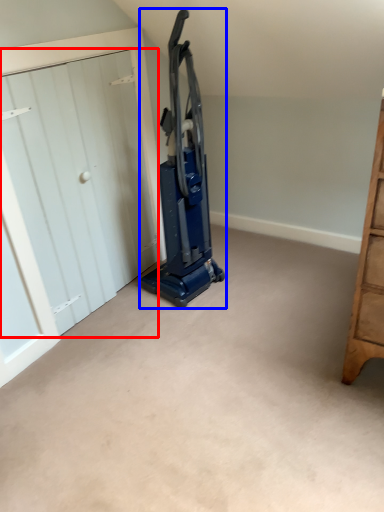
Question: Which of the following is the closest to the observer, door (highlighted by a red box) or equipment (highlighted by a blue box)?

Choices:
 (A) door
 (B) equipment

Answer: (A)